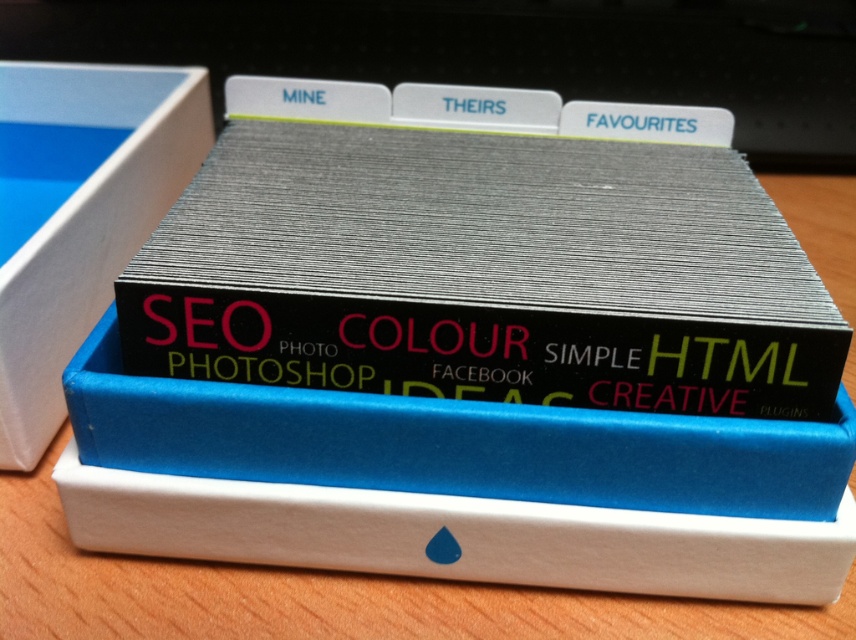
Does point (373, 278) come in front of point (176, 113)?

Yes, it is in front of point (176, 113).

Between metallic silver book at center and white cardboard box at left, which one has more height?

white cardboard box at left is taller.

Who is more forward, (586, 134) or (27, 269)?

Point (27, 269)

At what (x,y) coordinates should I click in order to perform the action: click on metallic silver book at center. Please return your answer as a coordinate pair (x, y). The height and width of the screenshot is (640, 856). Looking at the image, I should click on (482, 257).